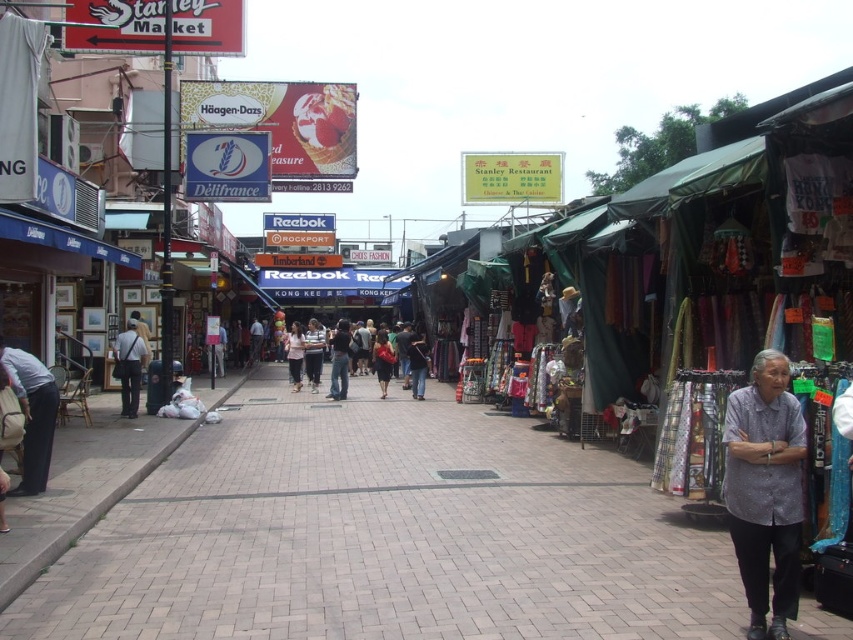
You are standing at the point labeled point [309,332] in the market. You want to walk to the entrance of the Reebok store, which is near the point labeled point [366,556]. Which direction should you move relative to your current position?

Since point [366,556] is in front of point [309,332], you should move forward towards the Reebok store located near point [366,556].

From the picture: You are a delivery person standing at the entrance of Stanley Market. You need to place a package on the brick pavement at center. However, there are light blue jeans at center in the way. Can you place the package there without moving the light blue jeans?

The brick pavement at center is not as tall as light blue jeans at center, so the light blue jeans are taller and might be blocking the area. Therefore, you cannot place the package there without moving the light blue jeans.